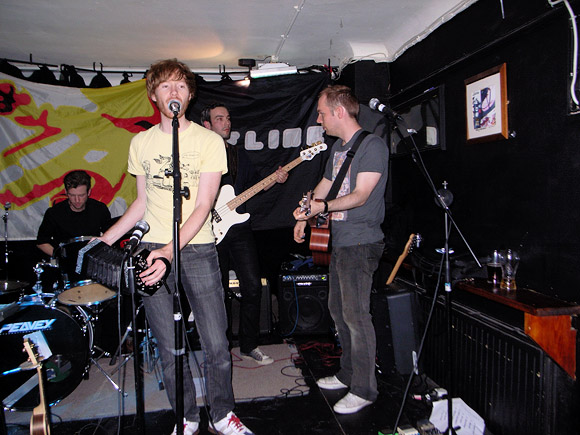
What are the coordinates of `ceiling` in the screenshot? It's located at (244, 28).